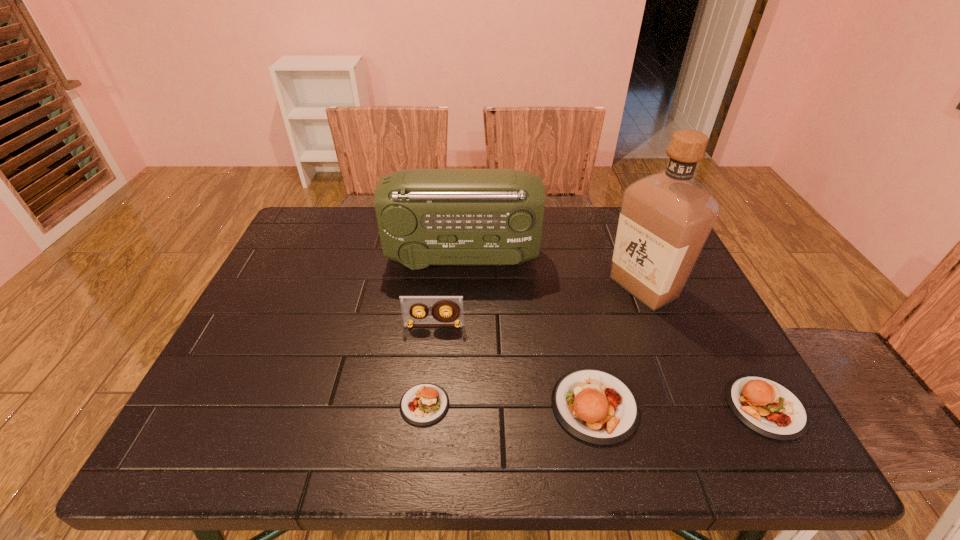
Please show where to add a patty (food) on the left while keeping spacing even. Please provide its 2D coordinates. Your answer should be formatted as a tuple, i.e. [(x, y)], where the tuple contains the x and y coordinates of a point satisfying the conditions above.

[(255, 403)]